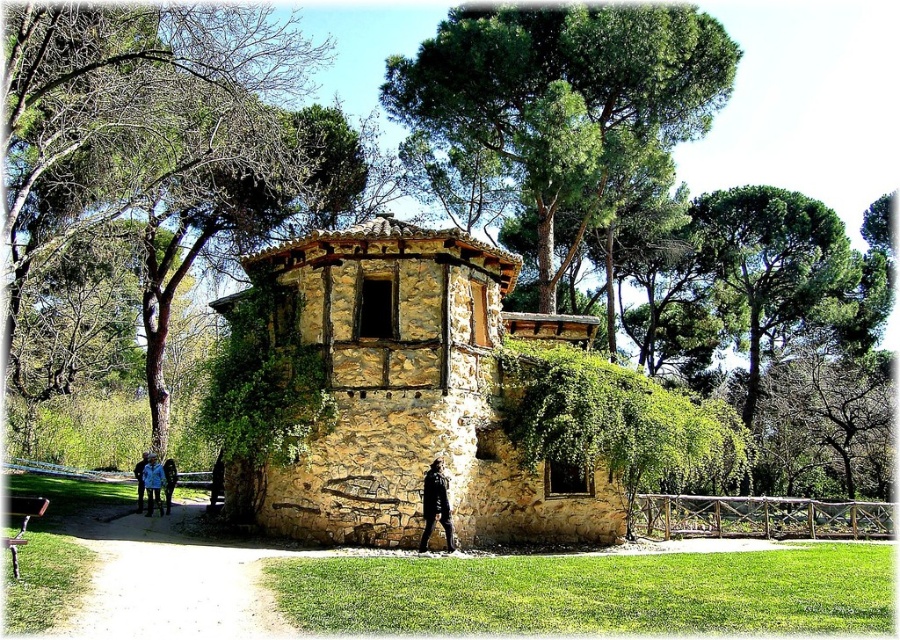
You are standing in the park and want to take a photo of the brown bark tree at upper left. If your camera can focus on objects up to 20 meters away, will you need to move closer to take a clear picture?

The brown bark tree at upper left is 21.60 meters away from you, which is beyond your camera maximum focus range of 20 meters. You need to move closer to ensure a clear photo.

You are standing in the park and see the brown bark tree at upper left and the black leather jacket at center. Which object is taller?

The brown bark tree at upper left is taller than the black leather jacket at center.

You are standing in front of the stone structure in the image and want to take a photo of the brown bark tree at upper left. If your camera has a maximum zoom range of 50 feet, will you need to move closer to capture the tree in focus?

The brown bark tree at upper left is 70.88 feet away from the camera. Since the camera can only zoom up to 50 feet, you need to move closer to ensure the tree is in focus.